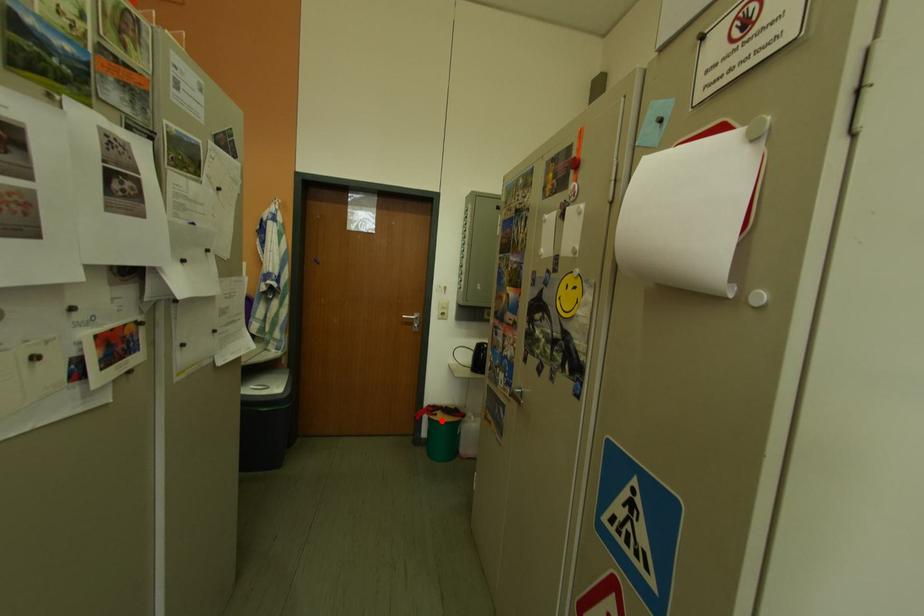
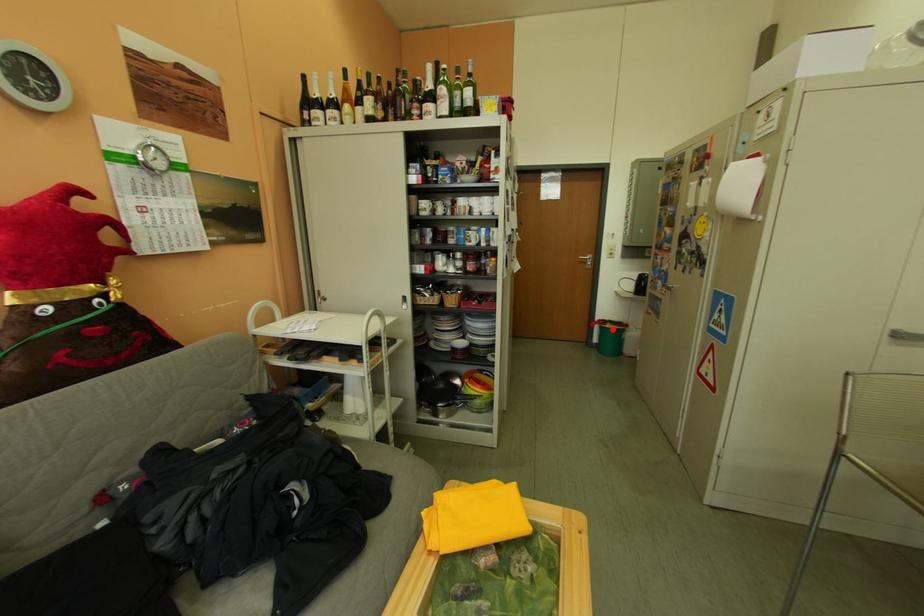
Consider the image. I am providing you with two images of the same scene from different viewpoints. A red point is marked on the first image and another point is marked on the second image. Are the points marked in image1 and image2 representing the same 3D position?

Yes